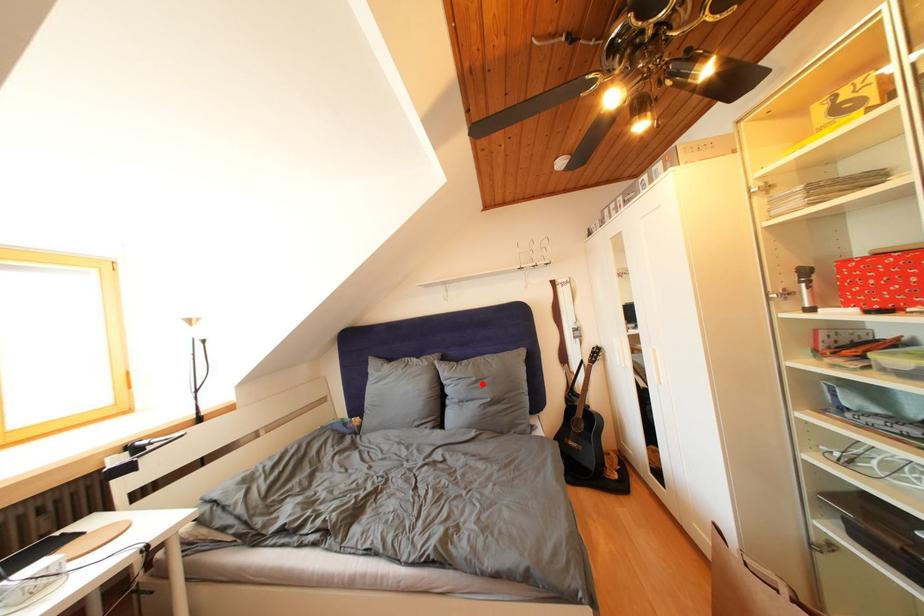
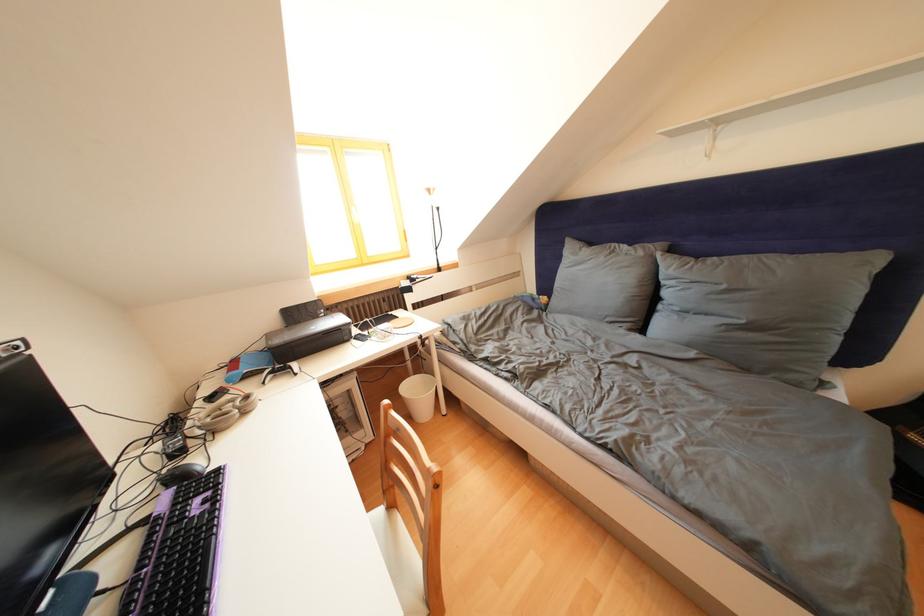
Where in the second image is the point corresponding to the highlighted location from the first image?

(733, 292)